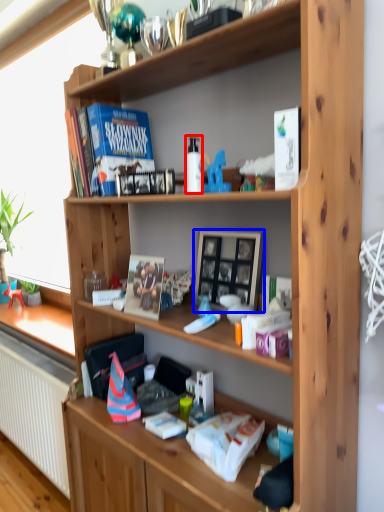
Question: Which object appears farthest to the camera in this image, bottle (highlighted by a red box) or picture frame (highlighted by a blue box)?

Choices:
 (A) bottle
 (B) picture frame

Answer: (B)